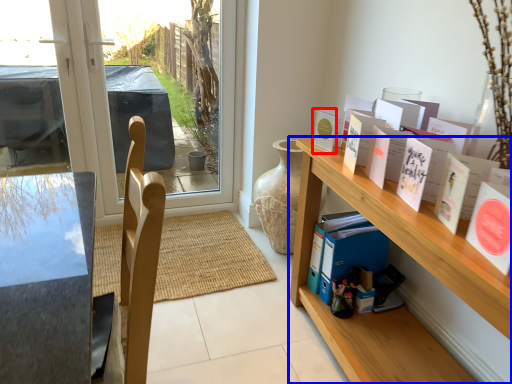
Question: Which object is further to the camera taking this photo, book (highlighted by a red box) or shelf (highlighted by a blue box)?

Choices:
 (A) book
 (B) shelf

Answer: (A)